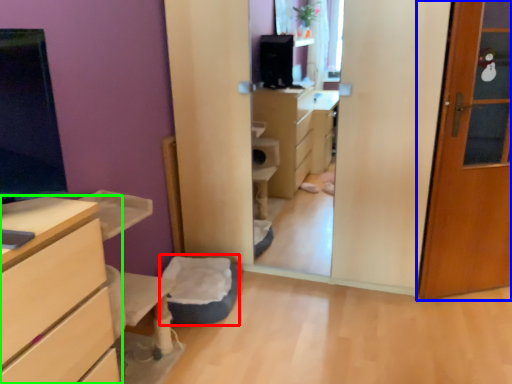
Question: Which is farther away from flat (highlighted by a red box)? door (highlighted by a blue box) or chest of drawers (highlighted by a green box)?

Choices:
 (A) door
 (B) chest of drawers

Answer: (A)